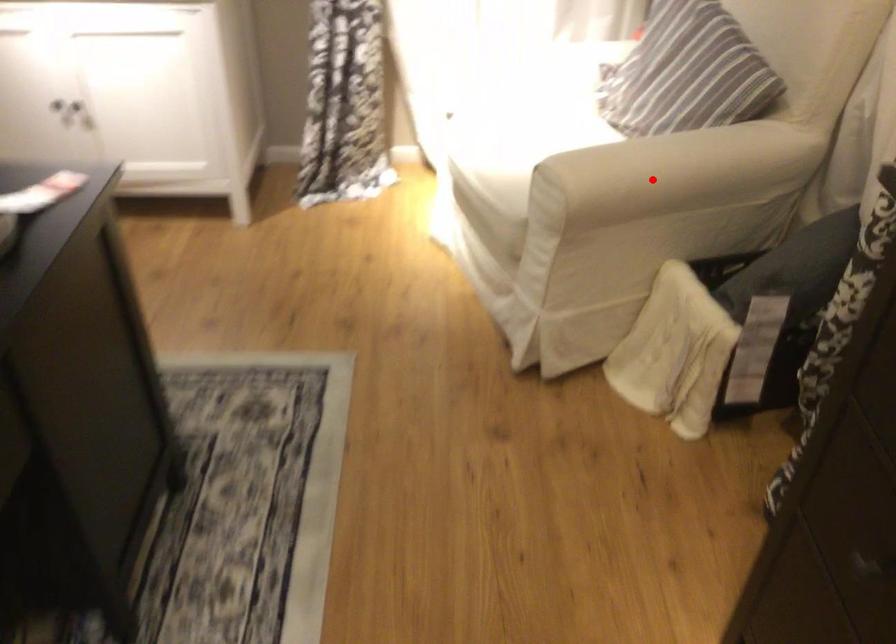
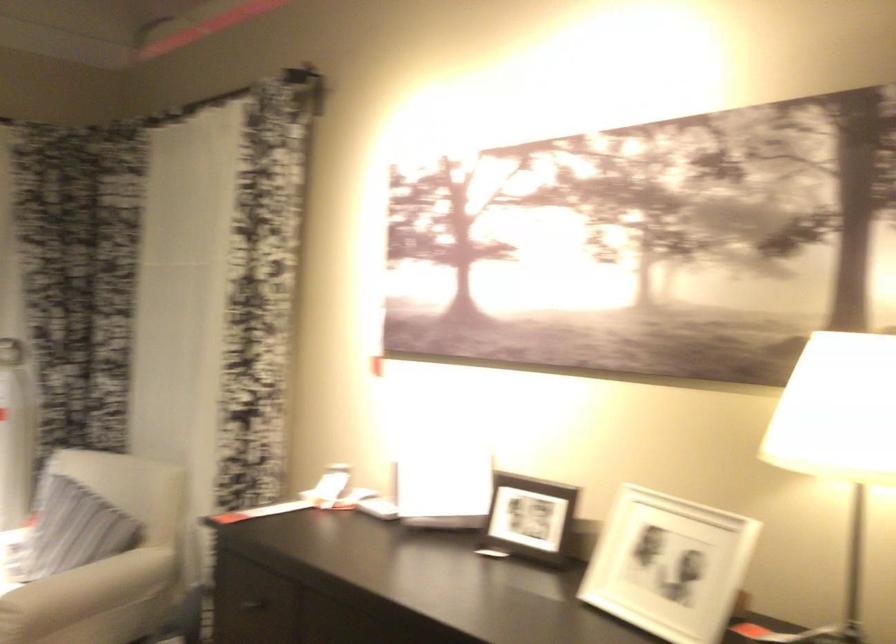
The point at the highlighted location is marked in the first image. Where is the corresponding point in the second image?

(85, 592)